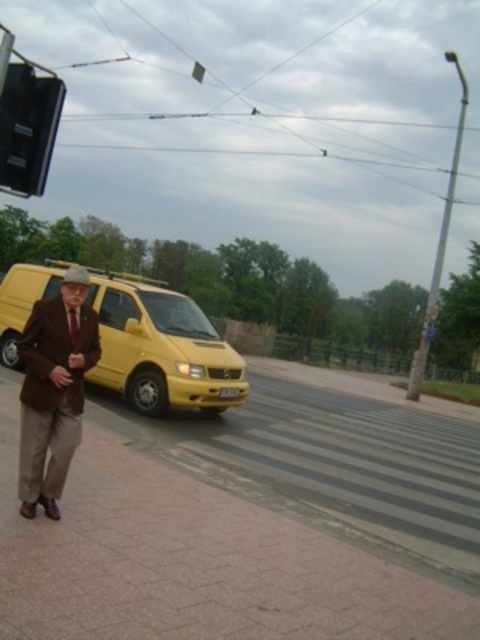
You are a pedestrian trying to cross the street safely. You see the yellow matte van at left and the black plastic traffic light at upper left. Which object is closer to you from your perspective on the sidewalk?

The yellow matte van at left is closer to you than the black plastic traffic light at upper left because the traffic light is positioned behind the van.

You are a pedestrian standing at the edge of the brown brick pavement at lower left and want to cross the street. The brown woolen suit at left is blocking your path. Can you walk around them without stepping off the pavement?

The brown brick pavement at lower left is closer to the viewer than the brown woolen suit at left, so the brown woolen suit at left is further away. Since the pavement is at your current position and the suit is ahead, you can walk around them by moving sideways along the pavement.

You are a pedestrian trying to cross the street. You see the yellow matte van at left and the black plastic traffic light at upper left. Which object is positioned higher from the ground?

The black plastic traffic light at upper left is positioned higher from the ground than the yellow matte van at left.